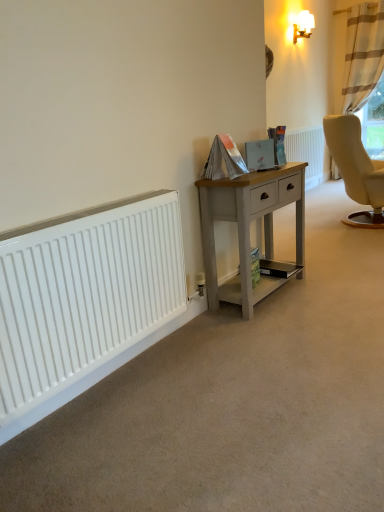
Question: From a real-world perspective, is beige striped curtain at upper right located higher than white glossy wall lamp at upper right?

Choices:
 (A) no
 (B) yes

Answer: (A)

Question: Considering the relative positions of beige striped curtain at upper right and white glossy wall lamp at upper right in the image provided, is beige striped curtain at upper right behind white glossy wall lamp at upper right?

Choices:
 (A) no
 (B) yes

Answer: (B)

Question: Does beige striped curtain at upper right appear on the right side of white glossy wall lamp at upper right?

Choices:
 (A) no
 (B) yes

Answer: (B)

Question: Can you confirm if beige striped curtain at upper right is shorter than white glossy wall lamp at upper right?

Choices:
 (A) yes
 (B) no

Answer: (B)

Question: Does beige striped curtain at upper right have a larger size compared to white glossy wall lamp at upper right?

Choices:
 (A) no
 (B) yes

Answer: (B)

Question: Is the surface of beige striped curtain at upper right in direct contact with white glossy wall lamp at upper right?

Choices:
 (A) yes
 (B) no

Answer: (B)

Question: Can you confirm if white glossy wall lamp at upper right is thinner than white textured radiator at center, the second radiator viewed from the left?

Choices:
 (A) no
 (B) yes

Answer: (A)

Question: From a real-world perspective, is white glossy wall lamp at upper right over white textured radiator at center, the 1th radiator positioned from the right?

Choices:
 (A) yes
 (B) no

Answer: (A)

Question: Is white glossy wall lamp at upper right shorter than white textured radiator at center, which ranks as the first radiator in top-to-bottom order?

Choices:
 (A) yes
 (B) no

Answer: (A)

Question: Does white glossy wall lamp at upper right come in front of white textured radiator at center, which ranks as the first radiator in top-to-bottom order?

Choices:
 (A) yes
 (B) no

Answer: (B)

Question: Is white glossy wall lamp at upper right positioned with its back to white textured radiator at center, acting as the 2th radiator starting from the bottom?

Choices:
 (A) yes
 (B) no

Answer: (B)

Question: Is white glossy wall lamp at upper right at the right side of white textured radiator at center, acting as the 2th radiator starting from the bottom?

Choices:
 (A) yes
 (B) no

Answer: (B)

Question: Can you confirm if light gray wood desk at center is taller than beige striped curtain at upper right?

Choices:
 (A) yes
 (B) no

Answer: (B)